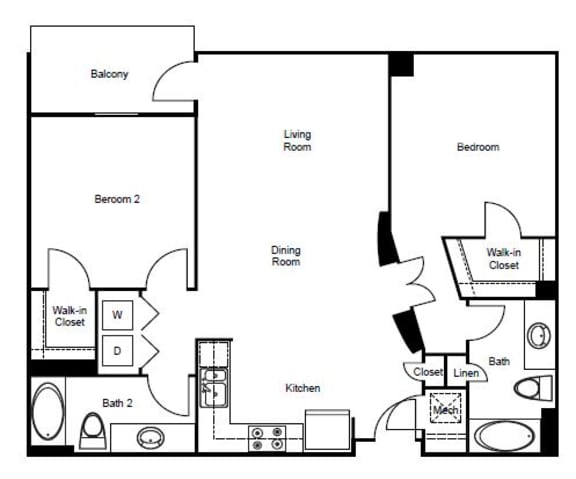
This screenshot has height=479, width=576. I want to click on bathroom, so click(120, 397), click(507, 360).